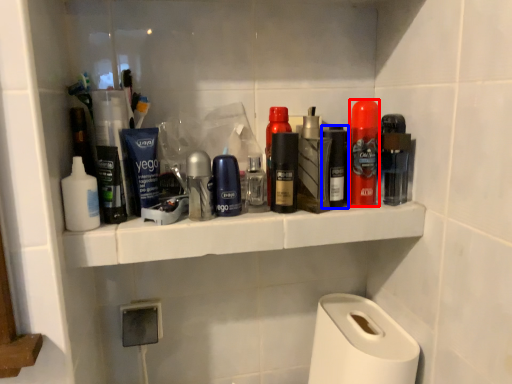
Question: Which object is further to the camera taking this photo, personal care (highlighted by a red box) or personal care (highlighted by a blue box)?

Choices:
 (A) personal care
 (B) personal care

Answer: (B)